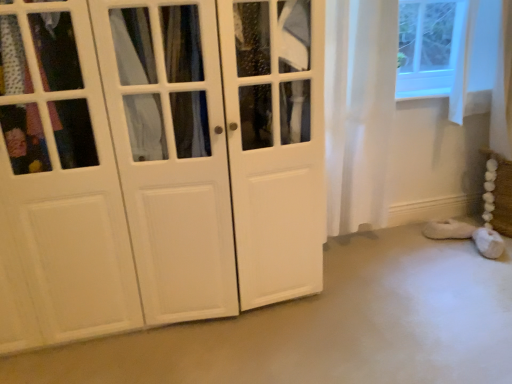
This screenshot has height=384, width=512. What are the coordinates of `free space to the right of white matte cabinet at left` in the screenshot? It's located at (379, 316).